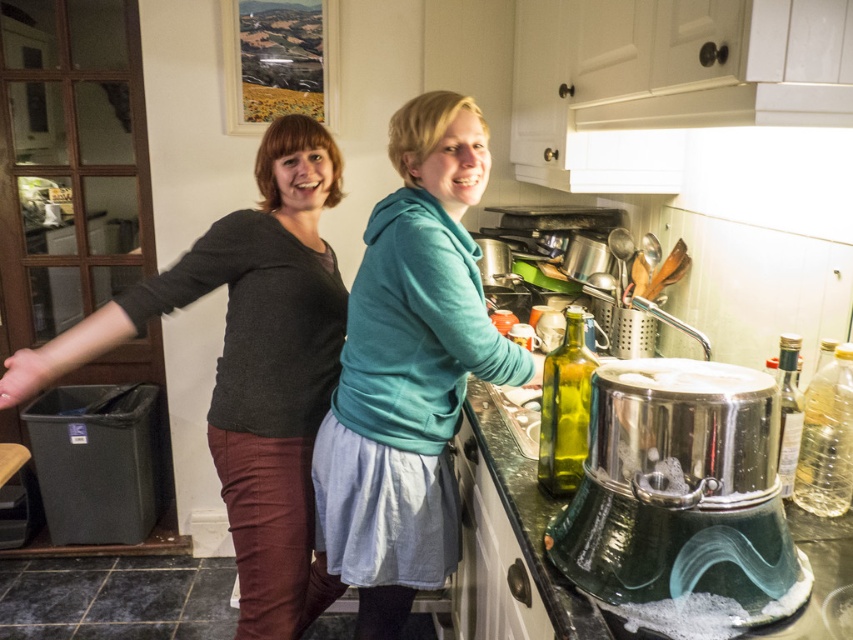
You are trying to decide which clothing item to grab quickly from the kitchen counter. The teal hoodie at center and the matte black sweater at left are both within reach. Which one is narrower so it can be grabbed faster?

The teal hoodie at center is thinner than the matte black sweater at left, so it can be grabbed faster due to its narrower width.

You are a chef in a busy kitchen and need to quickly grab the stainless steel pot at lower center. However, there is a teal hoodie at center in your way. Based on the scene, can you easily reach the pot without moving the hoodie?

The teal hoodie at center is much taller than the stainless steel pot at lower center, so it might block your access to the pot. You may need to move the hoodie to reach the pot easily.

You are organizing a clothing donation drive and need to determine which clothing item is shorter between the teal hoodie at center and the matte black sweater at left. Based on the scene description, which one should you list as shorter?

The teal hoodie at center has a lesser height compared to the matte black sweater at left, so the teal hoodie at center is shorter and should be listed as such.